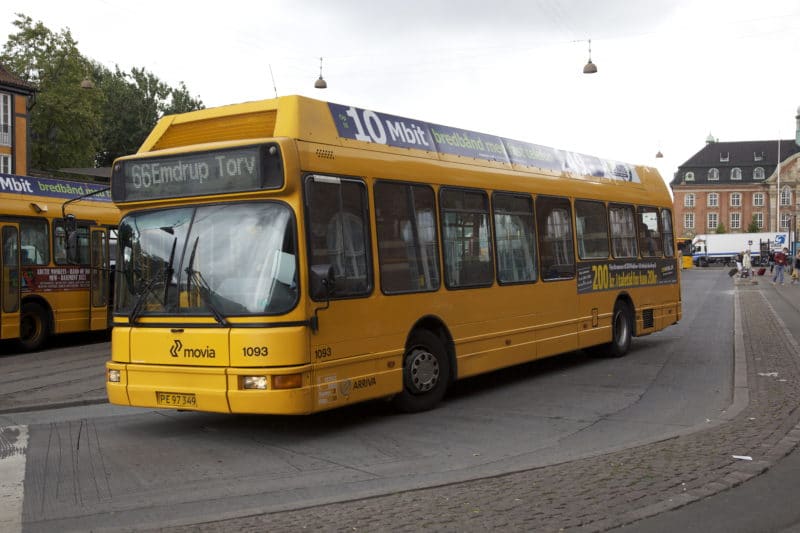
What are the coordinates of `windows` in the screenshot? It's located at (406, 248), (494, 244), (518, 242), (548, 233).